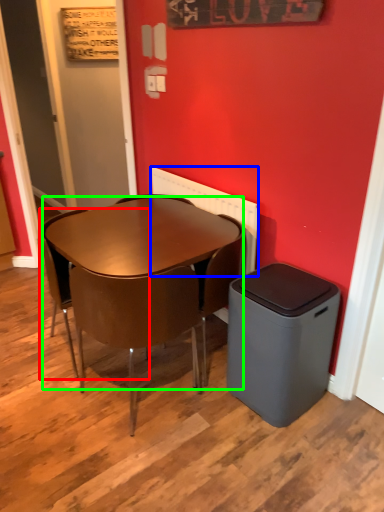
Question: Which is nearer to the chair (highlighted by a red box)? radiator (highlighted by a blue box) or desk (highlighted by a green box).

Choices:
 (A) radiator
 (B) desk

Answer: (B)